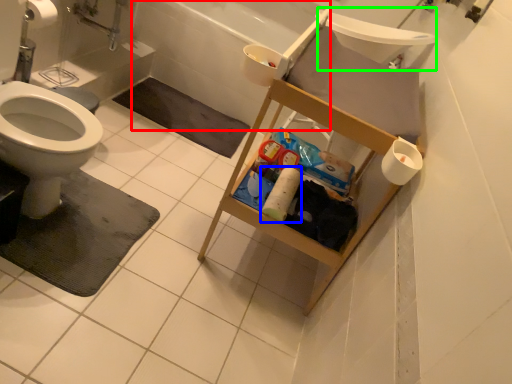
Question: Estimate the real-world distances between objects in this image. Which object is closer to bath (highlighted by a red box), toilet paper (highlighted by a blue box) or sink (highlighted by a green box)?

Choices:
 (A) toilet paper
 (B) sink

Answer: (B)